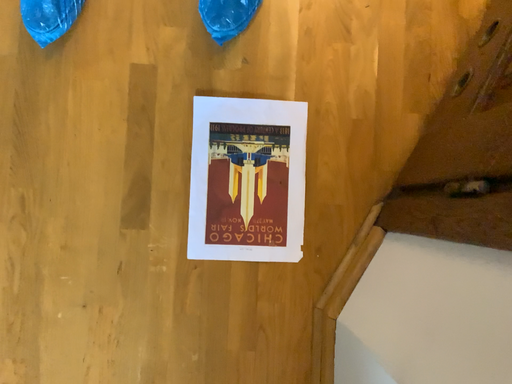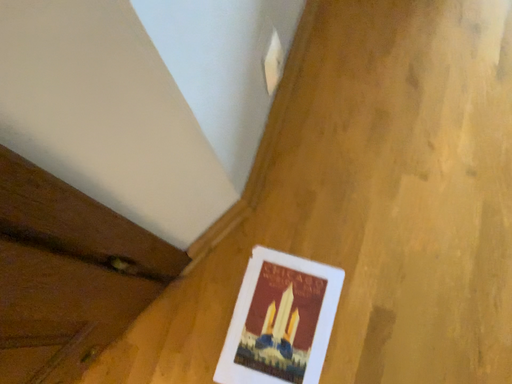
Question: How did the camera likely rotate when shooting the video?

Choices:
 (A) rotated upward
 (B) rotated downward

Answer: (A)